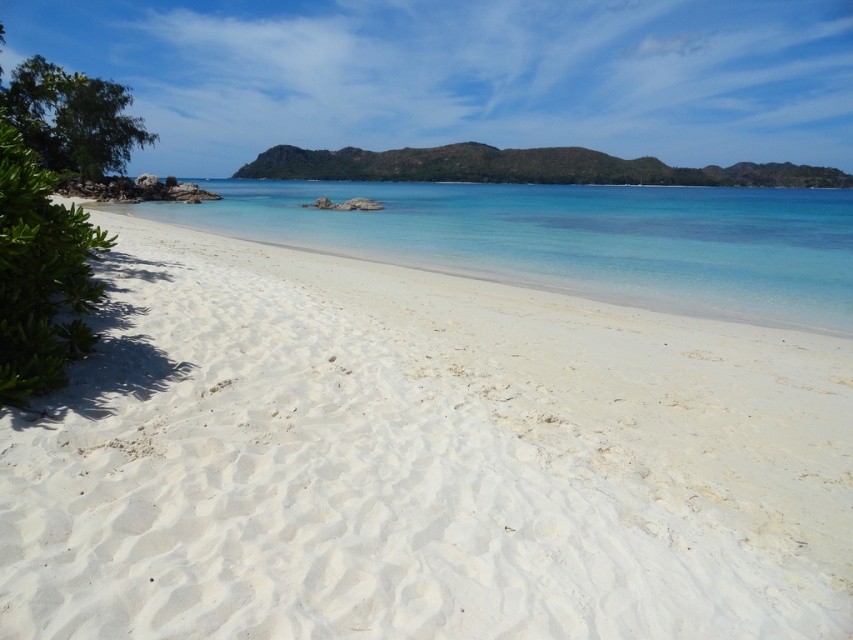
Who is positioned more to the right, clear blue water at center or green rocky island at center?

From the viewer's perspective, green rocky island at center appears more on the right side.

Does clear blue water at center appear over green rocky island at center?

No, clear blue water at center is not above green rocky island at center.

This screenshot has width=853, height=640. Describe the element at coordinates (573, 240) in the screenshot. I see `clear blue water at center` at that location.

Identify the location of clear blue water at center. The height and width of the screenshot is (640, 853). (573, 240).

Which is more to the right, white sandy beach at center or green rocky island at center?

From the viewer's perspective, green rocky island at center appears more on the right side.

Describe the element at coordinates (419, 461) in the screenshot. I see `white sandy beach at center` at that location.

In order to click on white sandy beach at center in this screenshot , I will do `click(419, 461)`.

Is white sandy beach at center below clear blue water at center?

Indeed, white sandy beach at center is positioned under clear blue water at center.

Does white sandy beach at center have a smaller size compared to clear blue water at center?

Indeed, white sandy beach at center has a smaller size compared to clear blue water at center.

Who is more distant from viewer, (113, 477) or (610, 204)?

The point (610, 204) is more distant.

You are a GUI agent. You are given a task and a screenshot of the screen. Output one action in this format:
    pyautogui.click(x=<x>, y=<y>)
    Task: Click on the white sandy beach at center
    The image size is (853, 640).
    Given the screenshot: What is the action you would take?
    pyautogui.click(x=419, y=461)